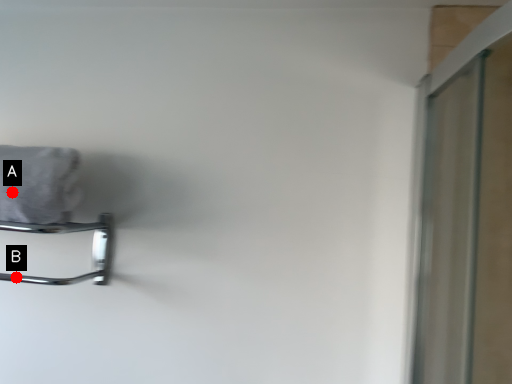
Question: Two points are circled on the image, labeled by A and B beside each circle. Which point is closer to the camera taking this photo?

Choices:
 (A) A is closer
 (B) B is closer

Answer: (A)